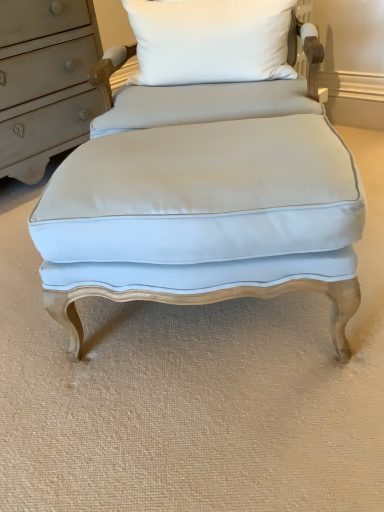
Question: Should I look upward or downward to see white fabric pillow at upper center?

Choices:
 (A) down
 (B) up

Answer: (B)

Question: Can you confirm if white fabric pillow at upper center is bigger than light blue fabric ottoman at center?

Choices:
 (A) no
 (B) yes

Answer: (A)

Question: From the image's perspective, is white fabric pillow at upper center beneath light blue fabric ottoman at center?

Choices:
 (A) no
 (B) yes

Answer: (A)

Question: Is white fabric pillow at upper center facing away from light blue fabric ottoman at center?

Choices:
 (A) yes
 (B) no

Answer: (B)

Question: From the image's perspective, is white fabric pillow at upper center above light blue fabric ottoman at center?

Choices:
 (A) yes
 (B) no

Answer: (A)

Question: Is white fabric pillow at upper center wider than light blue fabric ottoman at center?

Choices:
 (A) no
 (B) yes

Answer: (A)

Question: Does white fabric pillow at upper center have a lesser width compared to light blue fabric ottoman at center?

Choices:
 (A) yes
 (B) no

Answer: (A)

Question: Is light blue fabric ottoman at center wider than white fabric pillow at upper center?

Choices:
 (A) yes
 (B) no

Answer: (A)

Question: Does light blue fabric ottoman at center have a larger size compared to white fabric pillow at upper center?

Choices:
 (A) no
 (B) yes

Answer: (B)

Question: From the image's perspective, is light blue fabric ottoman at center beneath white fabric pillow at upper center?

Choices:
 (A) no
 (B) yes

Answer: (B)

Question: From a real-world perspective, does light blue fabric ottoman at center stand above white fabric pillow at upper center?

Choices:
 (A) yes
 (B) no

Answer: (B)

Question: Is white fabric pillow at upper center surrounded by light blue fabric ottoman at center?

Choices:
 (A) no
 (B) yes

Answer: (A)

Question: Does light blue fabric ottoman at center have a smaller size compared to white fabric pillow at upper center?

Choices:
 (A) yes
 (B) no

Answer: (B)

Question: From their relative heights in the image, would you say light blue fabric ottoman at center is taller or shorter than white fabric pillow at upper center?

Choices:
 (A) tall
 (B) short

Answer: (A)